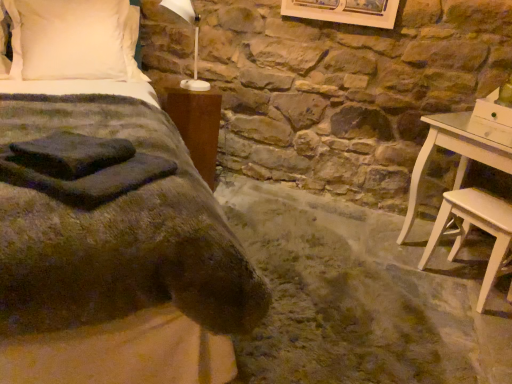
The image size is (512, 384). What do you see at coordinates (76, 38) in the screenshot?
I see `white soft pillow at upper left` at bounding box center [76, 38].

Describe the element at coordinates (197, 123) in the screenshot. I see `brown wood nightstand at left` at that location.

Identify the location of brown wood nightstand at left. (197, 123).

Locate an element on the screen. light wood stool at lower right is located at coordinates (476, 226).

The height and width of the screenshot is (384, 512). Identify the location of white soft pillow at upper left. (76, 38).

From the image's perspective, between light wood stool at lower right and dark green fabric bed at center, which one is located above?

From the image's view, dark green fabric bed at center is above.

Considering the relative sizes of light wood stool at lower right and dark green fabric bed at center in the image provided, is light wood stool at lower right wider than dark green fabric bed at center?

Incorrect, the width of light wood stool at lower right does not surpass that of dark green fabric bed at center.

Does light wood stool at lower right have a lesser height compared to dark green fabric bed at center?

Correct, light wood stool at lower right is not as tall as dark green fabric bed at center.

The image size is (512, 384). I want to click on nightstand that appears on the right of dark green fabric bed at center, so click(197, 123).

From a real-world perspective, is dark green fabric bed at center on top of brown wood nightstand at left?

Indeed, from a real-world perspective, dark green fabric bed at center stands above brown wood nightstand at left.

Does dark green fabric bed at center appear on the left side of brown wood nightstand at left?

Yes.

Does white soft pillow at upper left turn towards light wood stool at lower right?

No, white soft pillow at upper left does not turn towards light wood stool at lower right.

Is white soft pillow at upper left not within light wood stool at lower right?

Yes, white soft pillow at upper left is located beyond the bounds of light wood stool at lower right.

From a real-world perspective, which is physically below, white soft pillow at upper left or light wood stool at lower right?

light wood stool at lower right, from a real-world perspective.

Can you confirm if white soft pillow at upper left is shorter than light wood stool at lower right?

Incorrect, the height of white soft pillow at upper left does not fall short of that of light wood stool at lower right.

Looking at this image, does brown wood nightstand at left turn towards white soft pillow at upper left?

No, brown wood nightstand at left is not facing towards white soft pillow at upper left.

From a real-world perspective, is brown wood nightstand at left positioned over white soft pillow at upper left based on gravity?

No, from a real-world perspective, brown wood nightstand at left is not over white soft pillow at upper left

Can you tell me how much brown wood nightstand at left and white soft pillow at upper left differ in facing direction?

2.4 degrees.

Who is more distant, brown wood nightstand at left or white soft pillow at upper left?

brown wood nightstand at left.

Does light wood stool at lower right come in front of brown wood nightstand at left?

Yes, it is in front of brown wood nightstand at left.

From a real-world perspective, relative to brown wood nightstand at left, is light wood stool at lower right vertically above or below?

light wood stool at lower right is below brown wood nightstand at left.

Considering the sizes of objects light wood stool at lower right and brown wood nightstand at left in the image provided, who is bigger, light wood stool at lower right or brown wood nightstand at left?

With larger size is brown wood nightstand at left.

Measure the distance between light wood stool at lower right and brown wood nightstand at left.

4.85 feet.

Considering their positions, is white soft pillow at upper left located in front of or behind dark green fabric bed at center?

white soft pillow at upper left is positioned farther from the viewer than dark green fabric bed at center.

From the image's perspective, is white soft pillow at upper left under dark green fabric bed at center?

Incorrect, from the image's perspective, white soft pillow at upper left is higher than dark green fabric bed at center.

Is white soft pillow at upper left taller than dark green fabric bed at center?

No.

Which point is more forward, (x=109, y=47) or (x=76, y=256)?

The point (x=76, y=256) is closer.

Is dark green fabric bed at center aimed at white soft pillow at upper left?

No, dark green fabric bed at center is not facing towards white soft pillow at upper left.

Is dark green fabric bed at center spatially inside white soft pillow at upper left, or outside of it?

dark green fabric bed at center lies outside white soft pillow at upper left.

Considering the sizes of objects dark green fabric bed at center and white soft pillow at upper left in the image provided, who is taller, dark green fabric bed at center or white soft pillow at upper left?

With more height is dark green fabric bed at center.

Is dark green fabric bed at center wider than white soft pillow at upper left?

Yes, dark green fabric bed at center is wider than white soft pillow at upper left.

The image size is (512, 384). Find the location of `stool that is below the dark green fabric bed at center (from the image's perspective)`. stool that is below the dark green fabric bed at center (from the image's perspective) is located at coordinates (476, 226).

In order to click on bed located in front of the brown wood nightstand at left in this screenshot , I will do `click(106, 215)`.

When comparing their distances from light wood stool at lower right, does brown wood nightstand at left or dark green fabric bed at center seem further?

dark green fabric bed at center is further to light wood stool at lower right.

Looking at this image, based on their spatial positions, is dark green fabric bed at center or white soft pillow at upper left further from brown wood nightstand at left?

The object further to brown wood nightstand at left is dark green fabric bed at center.

Looking at the image, which one is located further to light wood stool at lower right, dark green fabric bed at center or white soft pillow at upper left?

Based on the image, white soft pillow at upper left appears to be further to light wood stool at lower right.

When comparing their distances from white soft pillow at upper left, does brown wood nightstand at left or light wood stool at lower right seem further?

Among the two, light wood stool at lower right is located further to white soft pillow at upper left.

Consider the image. Looking at the image, which one is located further to brown wood nightstand at left, light wood stool at lower right or dark green fabric bed at center?

light wood stool at lower right lies further to brown wood nightstand at left than the other object.

Based on the photo, considering their positions, is dark green fabric bed at center positioned closer to light wood stool at lower right than brown wood nightstand at left?

brown wood nightstand at left is positioned closer to the anchor light wood stool at lower right.

When comparing their distances from white soft pillow at upper left, does light wood stool at lower right or brown wood nightstand at left seem closer?

brown wood nightstand at left is positioned closer to the anchor white soft pillow at upper left.

Estimate the real-world distances between objects in this image. Which object is closer to brown wood nightstand at left, white soft pillow at upper left or dark green fabric bed at center?

Based on the image, white soft pillow at upper left appears to be nearer to brown wood nightstand at left.

Identify the location of nightstand between white soft pillow at upper left and light wood stool at lower right from left to right. This screenshot has height=384, width=512. (197, 123).

You are a GUI agent. You are given a task and a screenshot of the screen. Output one action in this format:
    pyautogui.click(x=<x>, y=<y>)
    Task: Click on the pillow between dark green fabric bed at center and brown wood nightstand at left along the z-axis
    Image resolution: width=512 pixels, height=384 pixels.
    Given the screenshot: What is the action you would take?
    pyautogui.click(x=76, y=38)

At what (x,y) coordinates should I click in order to perform the action: click on nightstand between dark green fabric bed at center and light wood stool at lower right. Please return your answer as a coordinate pair (x, y). The image size is (512, 384). Looking at the image, I should click on (x=197, y=123).

At what (x,y) coordinates should I click in order to perform the action: click on bed between white soft pillow at upper left and light wood stool at lower right in the horizontal direction. Please return your answer as a coordinate pair (x, y). Looking at the image, I should click on [106, 215].